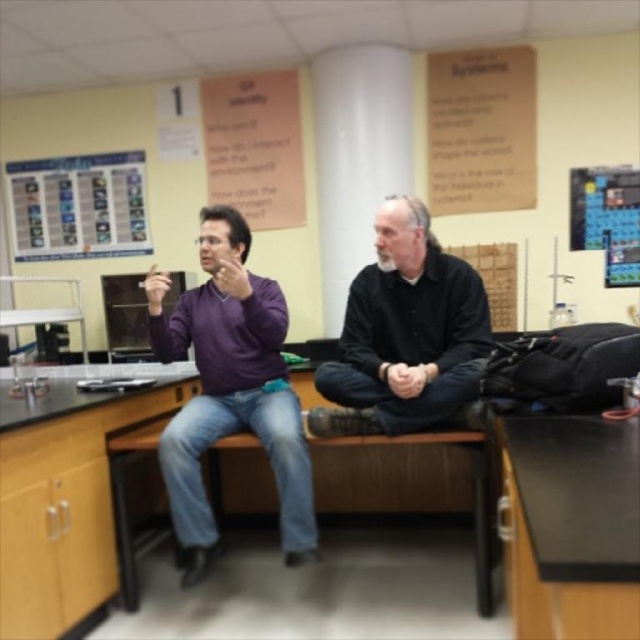
From the picture: Can you confirm if purple matte sweater at left is positioned to the right of metallic silver chart at upper left?

Yes, purple matte sweater at left is to the right of metallic silver chart at upper left.

Is purple matte sweater at left shorter than metallic silver chart at upper left?

Incorrect, purple matte sweater at left's height does not fall short of metallic silver chart at upper left's.

Between point (204, 381) and point (140, 221), which one is positioned in front?

Positioned in front is point (204, 381).

The image size is (640, 640). I want to click on purple matte sweater at left, so click(x=228, y=390).

Is black matte shirt at center below metallic silver chart at upper left?

Yes, black matte shirt at center is below metallic silver chart at upper left.

Is black matte shirt at center taller than metallic silver chart at upper left?

Indeed, black matte shirt at center has a greater height compared to metallic silver chart at upper left.

The height and width of the screenshot is (640, 640). I want to click on black matte shirt at center, so click(x=404, y=333).

Is metallic silver chart at upper left behind black laminate counter top at center?

Yes, it is behind black laminate counter top at center.

Is point (54, 237) behind point (54, 376)?

Yes.

Which is in front, point (65, 241) or point (90, 374)?

Point (90, 374) is more forward.

Find the location of a particular element. metallic silver chart at upper left is located at coordinates (77, 205).